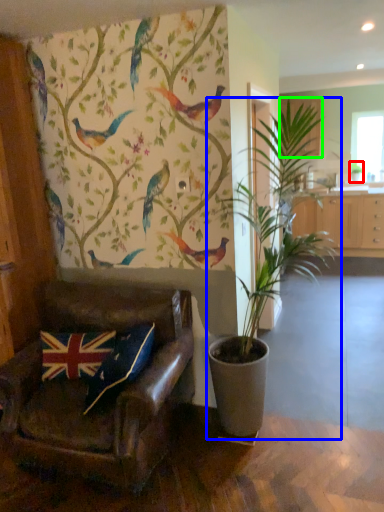
Question: Which is nearer to the houseplant (highlighted by a red box)? houseplant (highlighted by a blue box) or cabinetry (highlighted by a green box).

Choices:
 (A) houseplant
 (B) cabinetry

Answer: (B)